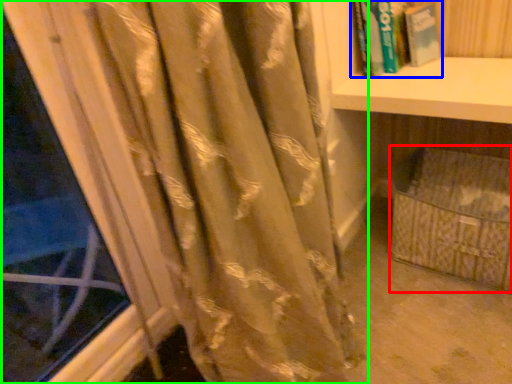
Question: Which object is the farthest from basket (highlighted by a red box)? Choose among these: book (highlighted by a blue box) or curtain (highlighted by a green box).

Choices:
 (A) book
 (B) curtain

Answer: (B)